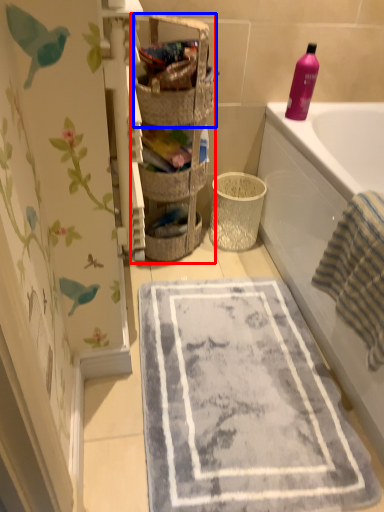
Question: Which object appears closest to the camera in this image, shelf (highlighted by a red box) or basket (highlighted by a blue box)?

Choices:
 (A) shelf
 (B) basket

Answer: (A)